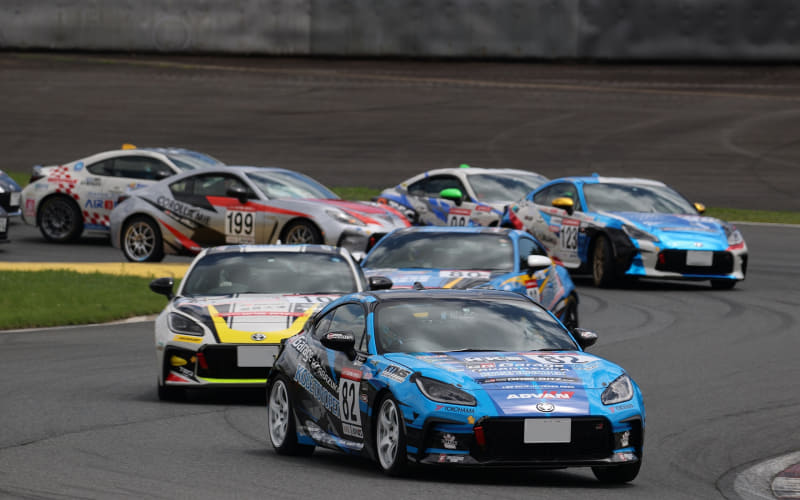
This screenshot has width=800, height=500. I want to click on side windows, so click(345, 336), click(532, 252), click(545, 200), click(438, 181), click(204, 187), click(132, 165).